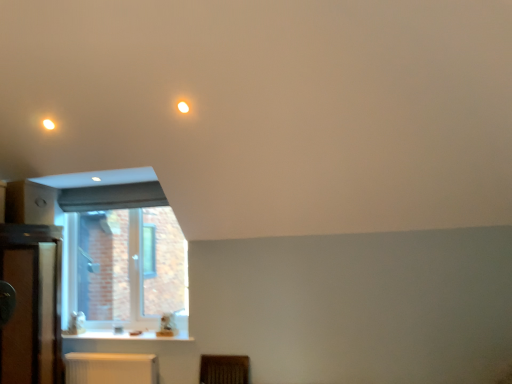
Question: In which direction should I rotate to look at matte white light at upper center, marked as the second lighting in a left-to-right arrangement?

Choices:
 (A) right
 (B) left

Answer: (B)

Question: From the image's perspective, is wooden dresser at left on matte white light at upper center, marked as the second lighting in a left-to-right arrangement?

Choices:
 (A) yes
 (B) no

Answer: (B)

Question: Is wooden dresser at left bigger than matte white light at upper center, marked as the 2th lighting in a back-to-front arrangement?

Choices:
 (A) yes
 (B) no

Answer: (A)

Question: Is wooden dresser at left to the left of matte white light at upper center, marked as the second lighting in a left-to-right arrangement, from the viewer's perspective?

Choices:
 (A) no
 (B) yes

Answer: (B)

Question: Can you confirm if wooden dresser at left is positioned to the right of matte white light at upper center, marked as the second lighting in a left-to-right arrangement?

Choices:
 (A) no
 (B) yes

Answer: (A)

Question: Could matte white light at upper center, marked as the first lighting in a front-to-back arrangement, be considered to be inside wooden dresser at left?

Choices:
 (A) yes
 (B) no

Answer: (B)

Question: Can you confirm if wooden dresser at left is smaller than matte white light at upper center, the first lighting viewed from the right?

Choices:
 (A) no
 (B) yes

Answer: (A)

Question: From the image's perspective, is white plastic radiator at lower center on top of white glossy counter top at lower left?

Choices:
 (A) no
 (B) yes

Answer: (A)

Question: From a real-world perspective, is white plastic radiator at lower center physically above white glossy counter top at lower left?

Choices:
 (A) no
 (B) yes

Answer: (A)

Question: From the image's perspective, is white plastic radiator at lower center under white glossy counter top at lower left?

Choices:
 (A) no
 (B) yes

Answer: (B)

Question: Is white plastic radiator at lower center turned away from white glossy counter top at lower left?

Choices:
 (A) no
 (B) yes

Answer: (A)

Question: Can you confirm if white plastic radiator at lower center is positioned to the right of white glossy counter top at lower left?

Choices:
 (A) yes
 (B) no

Answer: (B)

Question: Could you tell me if white plastic radiator at lower center is facing white glossy counter top at lower left?

Choices:
 (A) yes
 (B) no

Answer: (B)

Question: Can you confirm if white glossy counter top at lower left is smaller than white plastic radiator at lower center?

Choices:
 (A) no
 (B) yes

Answer: (B)